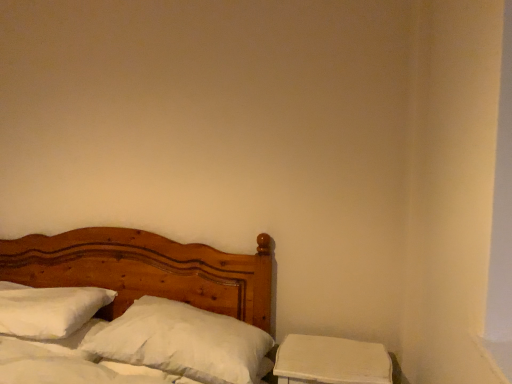
Question: From a real-world perspective, is wooden bed at left positioned under white soft pillow at center, which is the 1th pillow in right-to-left order, based on gravity?

Choices:
 (A) yes
 (B) no

Answer: (A)

Question: From the image's perspective, would you say wooden bed at left is positioned over white soft pillow at center, which is the 1th pillow in right-to-left order?

Choices:
 (A) no
 (B) yes

Answer: (A)

Question: Is wooden bed at left to the right of white soft pillow at center, which is the 1th pillow in right-to-left order, from the viewer's perspective?

Choices:
 (A) no
 (B) yes

Answer: (A)

Question: From a real-world perspective, is wooden bed at left on top of white soft pillow at center, which is the 1th pillow in right-to-left order?

Choices:
 (A) no
 (B) yes

Answer: (A)

Question: Is wooden bed at left not within white soft pillow at center, the 2th pillow from the left?

Choices:
 (A) no
 (B) yes

Answer: (B)

Question: From the image's perspective, is wooden bed at left located beneath white soft pillow at center, the 2th pillow from the left?

Choices:
 (A) yes
 (B) no

Answer: (A)

Question: Does white soft pillow at center, which is the 1th pillow in right-to-left order, have a smaller size compared to wooden bed at left?

Choices:
 (A) no
 (B) yes

Answer: (B)

Question: Could you tell me if white soft pillow at center, which is the 1th pillow in right-to-left order, is turned towards wooden bed at left?

Choices:
 (A) no
 (B) yes

Answer: (B)

Question: From the image's perspective, is white soft pillow at center, which is the 1th pillow in right-to-left order, over wooden bed at left?

Choices:
 (A) yes
 (B) no

Answer: (A)

Question: Is white soft pillow at center, the 2th pillow from the left, outside wooden bed at left?

Choices:
 (A) no
 (B) yes

Answer: (A)

Question: Is white soft pillow at center, the 2th pillow from the left, at the left side of wooden bed at left?

Choices:
 (A) no
 (B) yes

Answer: (A)

Question: From a real-world perspective, is white soft pillow at center, which is the 1th pillow in right-to-left order, over wooden bed at left?

Choices:
 (A) yes
 (B) no

Answer: (A)

Question: From a real-world perspective, is white matte nightstand at lower right on top of white soft pillow at center, the 2th pillow from the left?

Choices:
 (A) yes
 (B) no

Answer: (B)